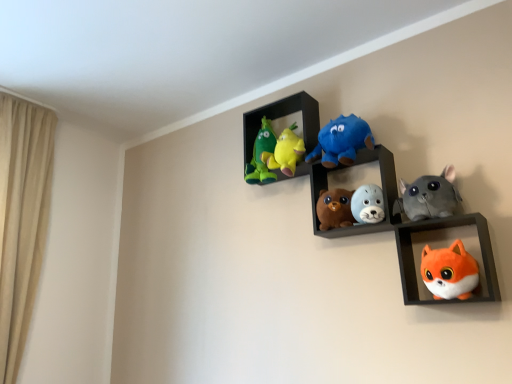
Question: Is soft plush toys at center, arranged as the second shelf when viewed from the front, further to camera compared to fluffy gray seal at center, the 3th toy positioned from the right?

Choices:
 (A) yes
 (B) no

Answer: (A)

Question: Is soft plush toys at center, arranged as the second shelf when viewed from the front, bigger than fluffy gray seal at center, the 3th toy positioned from the right?

Choices:
 (A) yes
 (B) no

Answer: (A)

Question: From the image's perspective, is soft plush toys at center, which appears as the 1th shelf when viewed from the back, located beneath fluffy gray seal at center, the 3th toy positioned from the right?

Choices:
 (A) no
 (B) yes

Answer: (A)

Question: Would you consider soft plush toys at center, arranged as the second shelf when viewed from the front, to be distant from fluffy gray seal at center, placed as the fourth toy when sorted from left to right?

Choices:
 (A) yes
 (B) no

Answer: (B)

Question: Is soft plush toys at center, arranged as the second shelf when viewed from the front, oriented away from fluffy gray seal at center, the 3th toy positioned from the right?

Choices:
 (A) yes
 (B) no

Answer: (A)

Question: Would you say blue plush toy at center, the 3th toy when ordered from left to right, is to the left or to the right of green plush toy at upper left, the first toy viewed from the left, in the picture?

Choices:
 (A) right
 (B) left

Answer: (A)

Question: Considering the positions of point (324, 155) and point (253, 182), is point (324, 155) closer or farther from the camera than point (253, 182)?

Choices:
 (A) farther
 (B) closer

Answer: (B)

Question: Choose the correct answer: Is blue plush toy at center, the 3th toy when ordered from left to right, inside green plush toy at upper left, acting as the sixth toy starting from the right, or outside it?

Choices:
 (A) outside
 (B) inside

Answer: (A)

Question: In terms of size, does blue plush toy at center, which is the fourth toy in right-to-left order, appear bigger or smaller than green plush toy at upper left, acting as the sixth toy starting from the right?

Choices:
 (A) small
 (B) big

Answer: (B)

Question: Would you say brown plush bear at center, which appears as the 2th toy when viewed from the left, is inside or outside orange plush fox at lower right, the second shelf positioned from the back?

Choices:
 (A) inside
 (B) outside

Answer: (B)

Question: Considering the positions of brown plush bear at center, the fifth toy viewed from the right, and orange plush fox at lower right, the second shelf positioned from the back, in the image, is brown plush bear at center, the fifth toy viewed from the right, wider or thinner than orange plush fox at lower right, the second shelf positioned from the back,?

Choices:
 (A) wide
 (B) thin

Answer: (B)

Question: Does point (323, 210) appear closer or farther from the camera than point (412, 281)?

Choices:
 (A) farther
 (B) closer

Answer: (A)

Question: From the image's perspective, relative to orange plush fox at lower right, which is the 1th shelf from front to back, is brown plush bear at center, the fifth toy viewed from the right, above or below?

Choices:
 (A) below
 (B) above

Answer: (B)

Question: Is fluffy gray seal at center, placed as the fourth toy when sorted from left to right, inside or outside of brown plush bear at center, which appears as the 2th toy when viewed from the left?

Choices:
 (A) inside
 (B) outside

Answer: (B)

Question: Is fluffy gray seal at center, placed as the fourth toy when sorted from left to right, bigger or smaller than brown plush bear at center, which appears as the 2th toy when viewed from the left?

Choices:
 (A) small
 (B) big

Answer: (A)